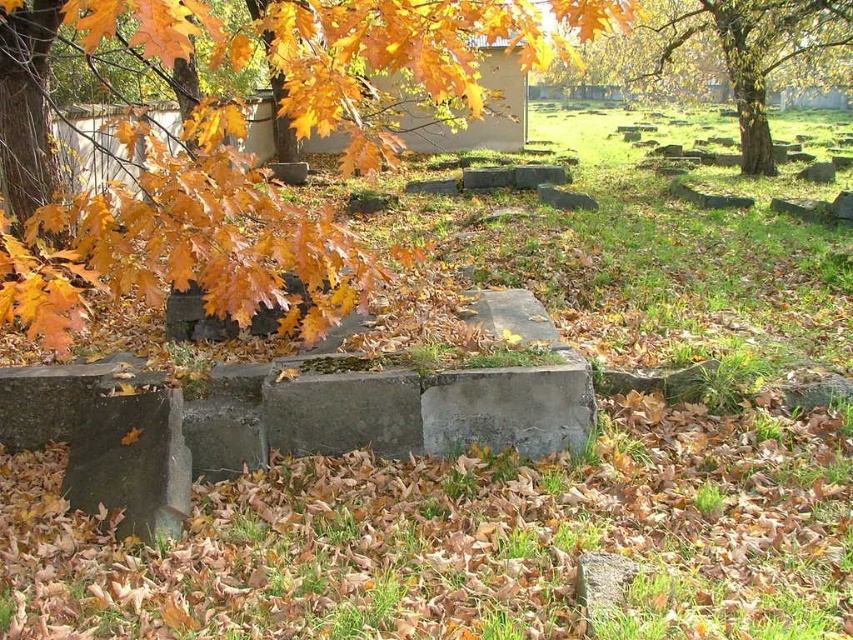
Does golden leaves at upper left lie behind golden oak tree at upper right?

That is False.

Does point (222, 56) lie behind point (762, 52)?

No, it is not.

Is point (138, 180) closer to viewer compared to point (749, 48)?

Yes, it is.

Find the location of a particular element. golden leaves at upper left is located at coordinates (187, 241).